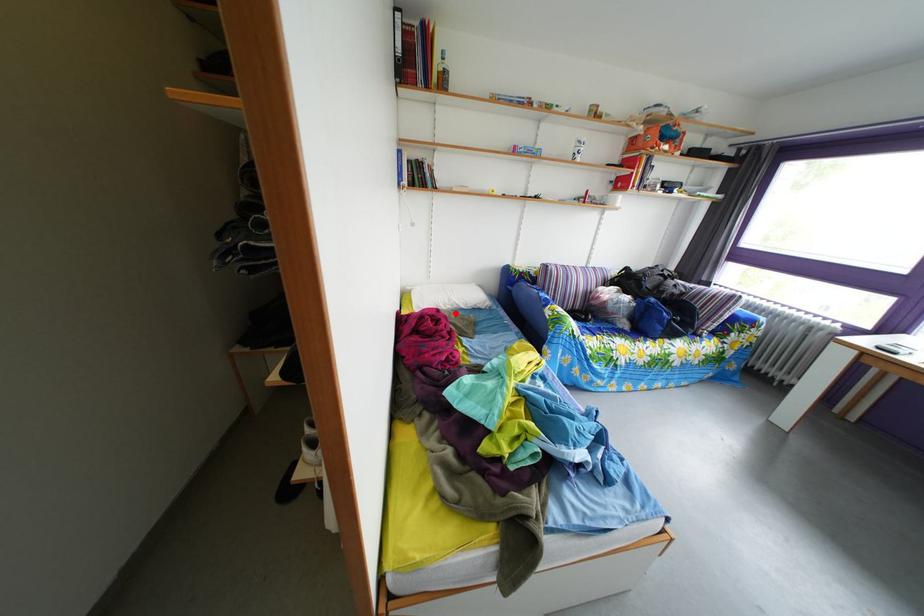
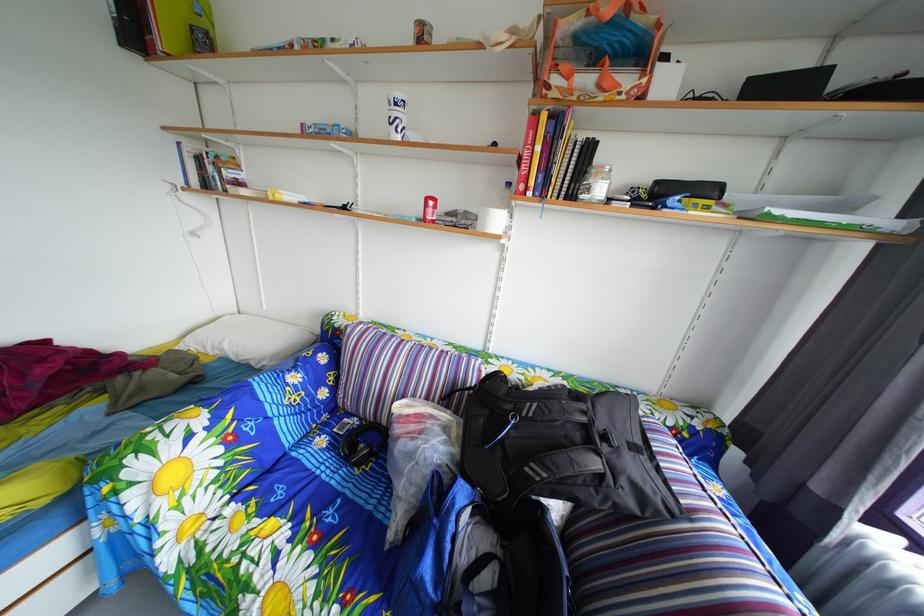
Where in the second image is the point corresponding to the highlighted location from the first image?

(224, 357)